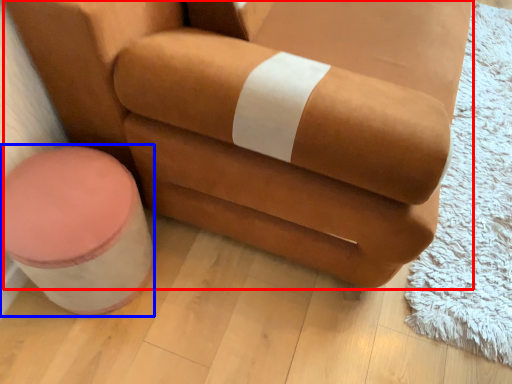
Question: Among these objects, which one is farthest to the camera, chair (highlighted by a red box) or stool (highlighted by a blue box)?

Choices:
 (A) chair
 (B) stool

Answer: (B)